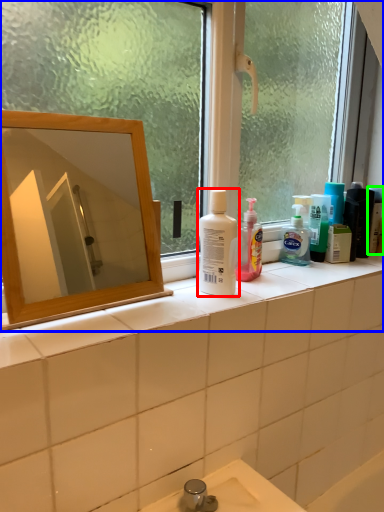
Question: Based on their relative distances, which object is farther from cleaning product (highlighted by a red box)? Choose from window (highlighted by a blue box) and toiletry (highlighted by a green box).

Choices:
 (A) window
 (B) toiletry

Answer: (B)